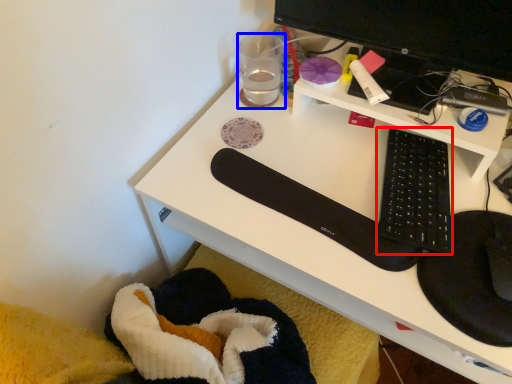
Question: Among these objects, which one is nearest to the camera, computer keyboard (highlighted by a red box) or stationery (highlighted by a blue box)?

Choices:
 (A) computer keyboard
 (B) stationery

Answer: (A)